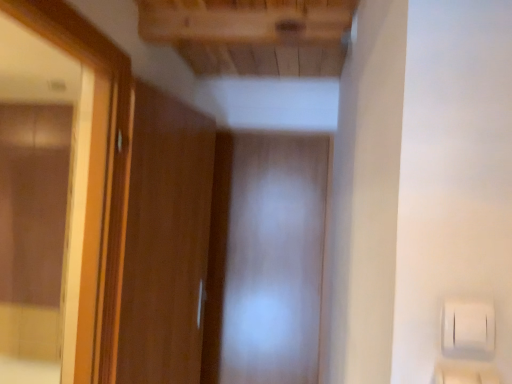
Question: From the image's perspective, is wooden door at left positioned above or below transparent plastic screen door at center?

Choices:
 (A) below
 (B) above

Answer: (B)

Question: Is wooden door at left inside or outside of transparent plastic screen door at center?

Choices:
 (A) outside
 (B) inside

Answer: (A)

Question: Considering the real-world distances, which object is closest to the wooden frame mirror at left?

Choices:
 (A) transparent plastic screen door at center
 (B) wooden door at left

Answer: (B)

Question: Estimate the real-world distances between objects in this image. Which object is closer to the wooden door at left?

Choices:
 (A) wooden frame mirror at left
 (B) transparent plastic screen door at center

Answer: (A)